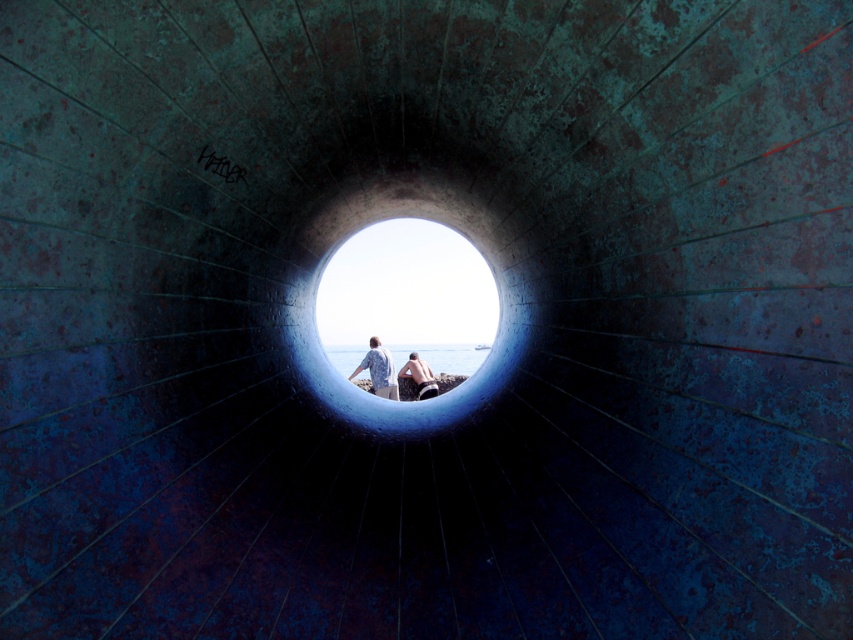
Question: Which of the following is the closest to the observer?

Choices:
 (A) smooth skin person at center
 (B) smooth concrete hole at center
 (C) blue printed shirt at center

Answer: (A)

Question: Does blue printed shirt at center appear on the right side of smooth skin person at center?

Choices:
 (A) yes
 (B) no

Answer: (B)

Question: Does smooth concrete hole at center lie behind smooth skin person at center?

Choices:
 (A) no
 (B) yes

Answer: (B)

Question: Which of these objects is positioned farthest from the smooth skin person at center?

Choices:
 (A) blue printed shirt at center
 (B) smooth concrete hole at center

Answer: (B)

Question: Does smooth concrete hole at center have a larger size compared to blue printed shirt at center?

Choices:
 (A) yes
 (B) no

Answer: (A)

Question: Among these objects, which one is farthest from the camera?

Choices:
 (A) blue printed shirt at center
 (B) smooth skin person at center
 (C) smooth concrete hole at center

Answer: (C)